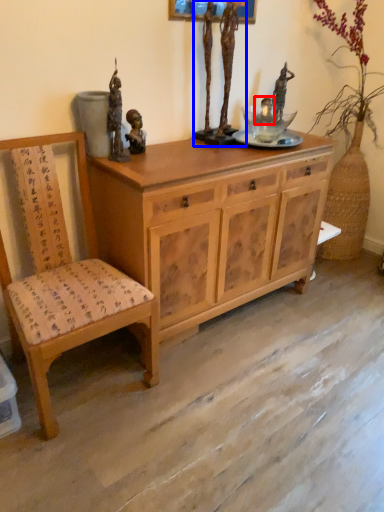
Question: Which of the following is the farthest to the observer, person (highlighted by a red box) or sculpture (highlighted by a blue box)?

Choices:
 (A) person
 (B) sculpture

Answer: (A)